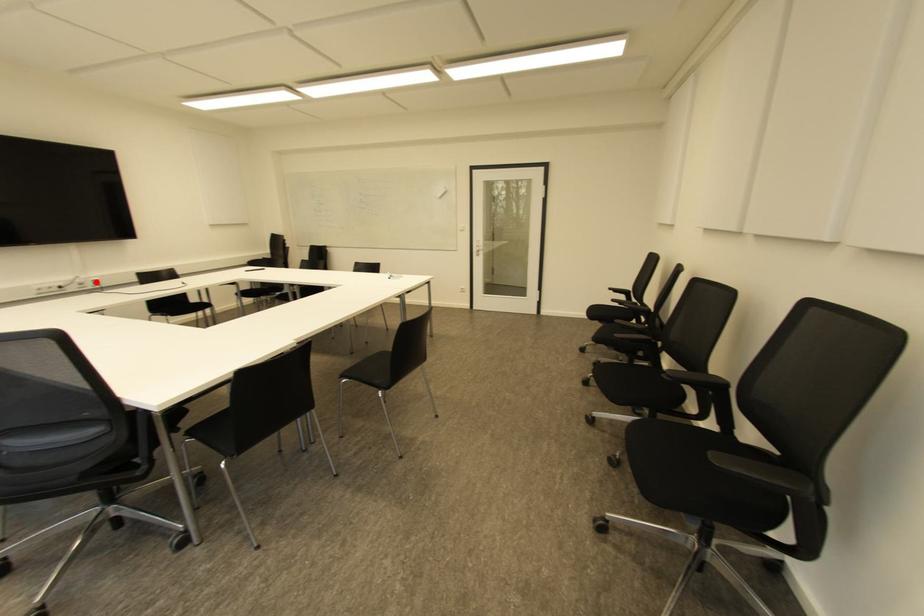
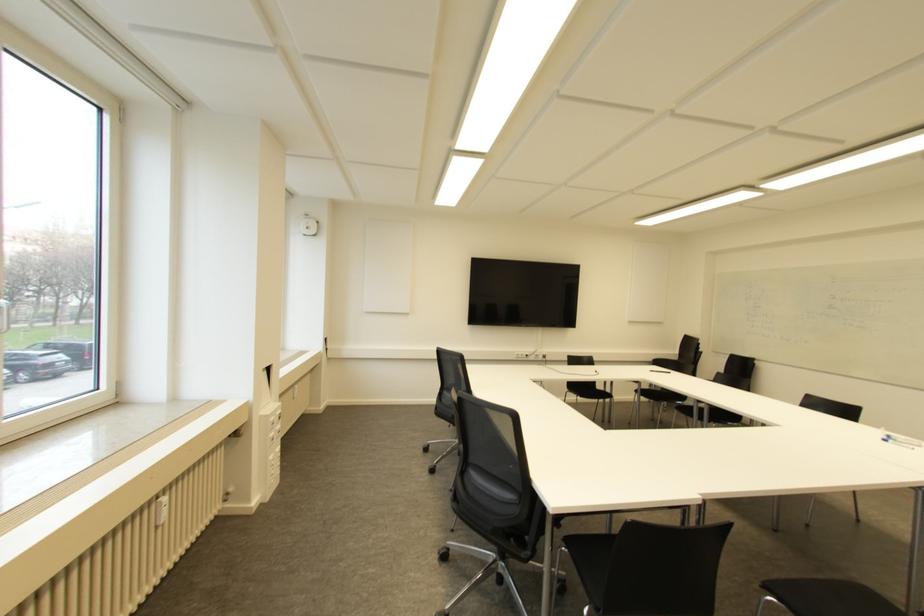
The point at the highlighted location is marked in the first image. Where is the corresponding point in the second image?

(543, 355)